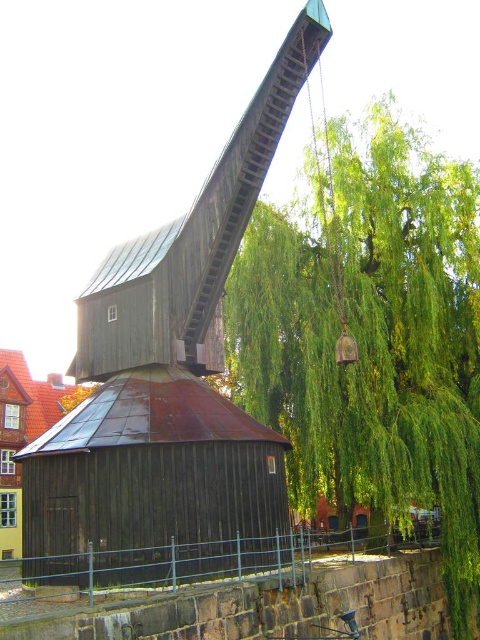
Question: Which of the following is the closest to the observer?

Choices:
 (A) green leafy tree at center
 (B) wooden barn at center

Answer: (A)

Question: Is green leafy tree at center bigger than wooden barn at center?

Choices:
 (A) yes
 (B) no

Answer: (A)

Question: In this image, where is green leafy tree at center located relative to wooden barn at center?

Choices:
 (A) above
 (B) below

Answer: (A)

Question: Which object appears farthest from the camera in this image?

Choices:
 (A) green leafy tree at center
 (B) wooden barn at center

Answer: (B)

Question: Can you confirm if green leafy tree at center is bigger than wooden barn at center?

Choices:
 (A) no
 (B) yes

Answer: (B)